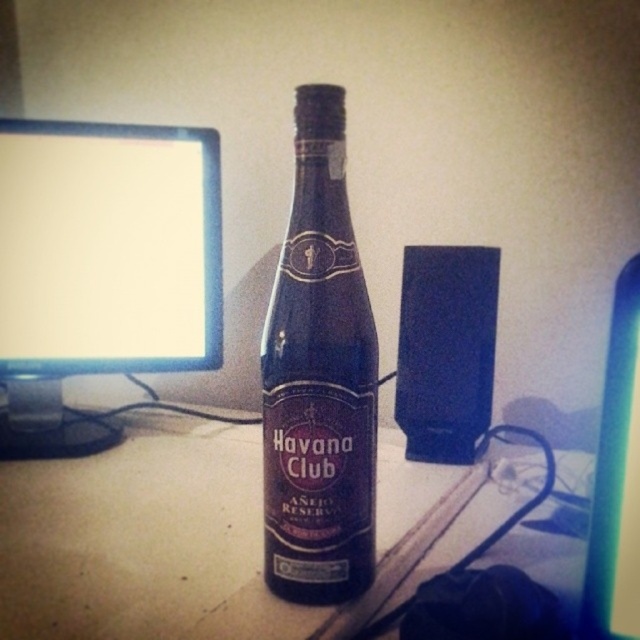
Question: Can you confirm if matte black monitor at left is positioned above dark glass bottle at center?

Choices:
 (A) yes
 (B) no

Answer: (A)

Question: Can you confirm if matte plastic computer desk at center is smaller than dark glass bottle at center?

Choices:
 (A) no
 (B) yes

Answer: (A)

Question: Which point is farther to the camera?

Choices:
 (A) transparent plastic computer monitor at upper left
 (B) dark glass bottle at center
 (C) matte black monitor at left

Answer: (C)

Question: Which of these objects is positioned closest to the matte plastic computer desk at center?

Choices:
 (A) dark glass bottle at center
 (B) matte black monitor at left
 (C) transparent plastic computer monitor at upper left

Answer: (A)

Question: Can you confirm if matte plastic computer desk at center is positioned to the left of dark glass bottle at center?

Choices:
 (A) no
 (B) yes

Answer: (A)

Question: Which point is closer to the camera?

Choices:
 (A) dark glass bottle at center
 (B) matte black monitor at left

Answer: (A)